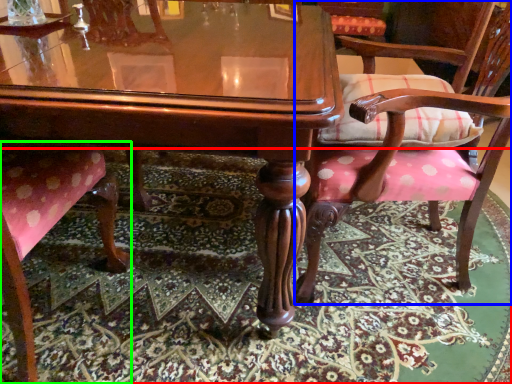
Question: Considering the real-world distances, which object is closest to mat (highlighted by a red box)? chair (highlighted by a blue box) or chair (highlighted by a green box).

Choices:
 (A) chair
 (B) chair

Answer: (A)